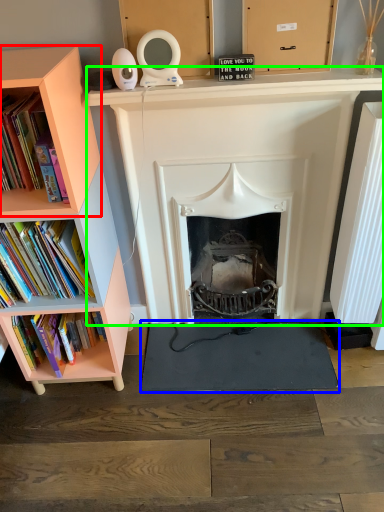
Question: Estimate the real-world distances between objects in this image. Which object is closer to shelf (highlighted by a red box), yoga mat (highlighted by a blue box) or fireplace (highlighted by a green box)?

Choices:
 (A) yoga mat
 (B) fireplace

Answer: (B)